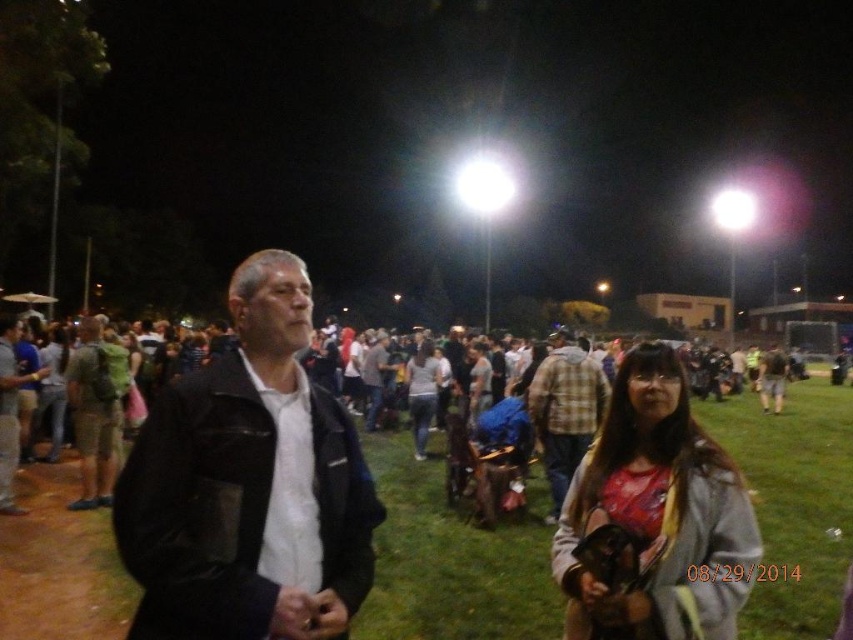
Is point (552, 369) positioned after point (413, 387)?

No.

Is point (543, 420) behind point (425, 390)?

That is False.

Locate an element on the screen. plaid fabric shirt at center is located at coordinates (566, 410).

Between matte red shirt at center and matte gray shirt at center, which one appears on the left side from the viewer's perspective?

matte gray shirt at center is more to the left.

Which is above, matte red shirt at center or matte gray shirt at center?

matte red shirt at center is above.

Which is in front, point (633, 577) or point (376, 412)?

Point (633, 577) is more forward.

Locate an element on the screen. The width and height of the screenshot is (853, 640). matte red shirt at center is located at coordinates (654, 518).

Is point (157, 636) less distant than point (425, 426)?

Yes.

Between point (173, 611) and point (415, 388), which one is positioned behind?

The point (415, 388) is behind.

Locate an element on the screen. black leather jacket at center is located at coordinates (248, 484).